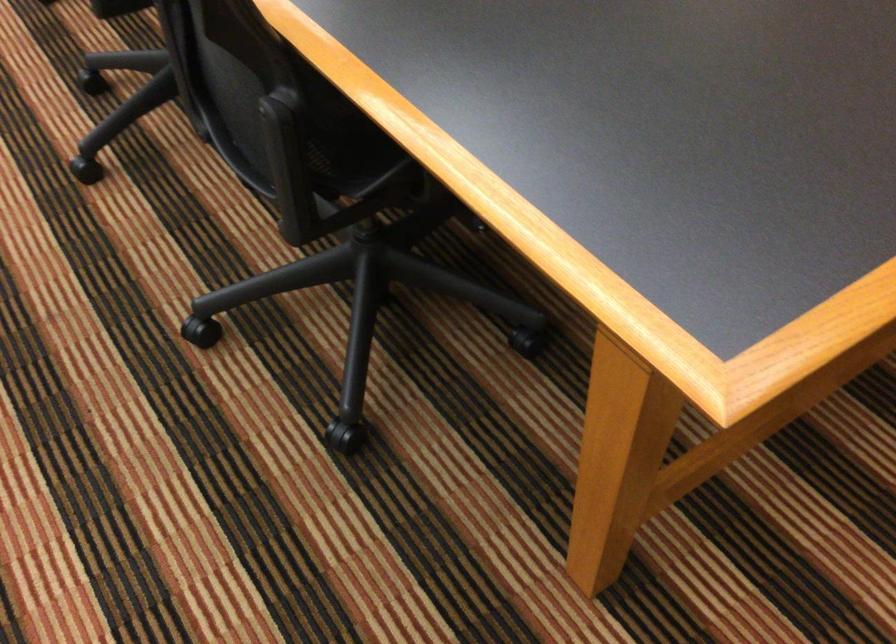
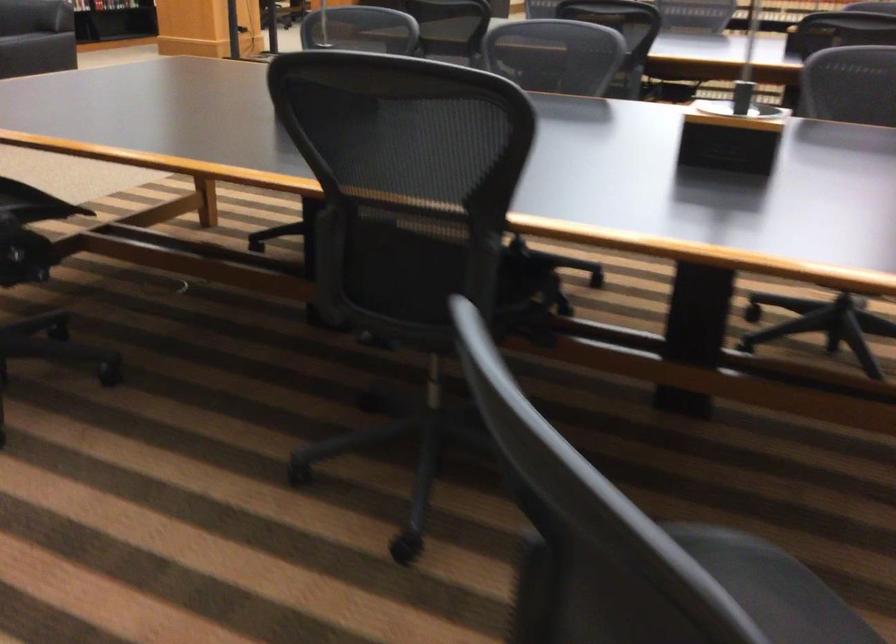
Question: I am providing you with two images of the same scene from different viewpoints. Please identify which objects are invisible in image2.

Choices:
 (A) chair sitting surface
 (B) orange chair armrest
 (C) black chair wheel
 (D) sofa armrest

Answer: (C)